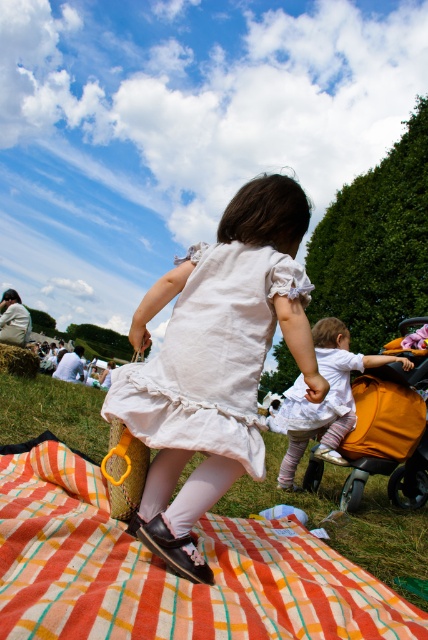
Does white cotton dress at center appear over orange fabric baby carriage at lower right?

Yes, white cotton dress at center is above orange fabric baby carriage at lower right.

Between white cotton dress at center and orange fabric baby carriage at lower right, which one is positioned lower?

orange fabric baby carriage at lower right is lower down.

Where is `white cotton dress at center`? Image resolution: width=428 pixels, height=640 pixels. white cotton dress at center is located at coordinates (210, 356).

Can you confirm if plaid fabric quilt at center is wider than white cotton dress at center?

Yes, plaid fabric quilt at center is wider than white cotton dress at center.

Does plaid fabric quilt at center appear under white cotton dress at center?

Correct, plaid fabric quilt at center is located below white cotton dress at center.

Is point (342, 563) behind point (189, 390)?

Yes, point (342, 563) is farther from viewer.

Identify the location of plaid fabric quilt at center. The image size is (428, 640). (171, 573).

In the scene shown: Does plaid fabric quilt at center come behind orange fabric baby carriage at lower right?

That is False.

Can you confirm if plaid fabric quilt at center is thinner than orange fabric baby carriage at lower right?

Incorrect, plaid fabric quilt at center's width is not less than orange fabric baby carriage at lower right's.

Between point (146, 595) and point (388, 448), which one is positioned behind?

Point (388, 448)

The width and height of the screenshot is (428, 640). I want to click on plaid fabric quilt at center, so click(x=171, y=573).